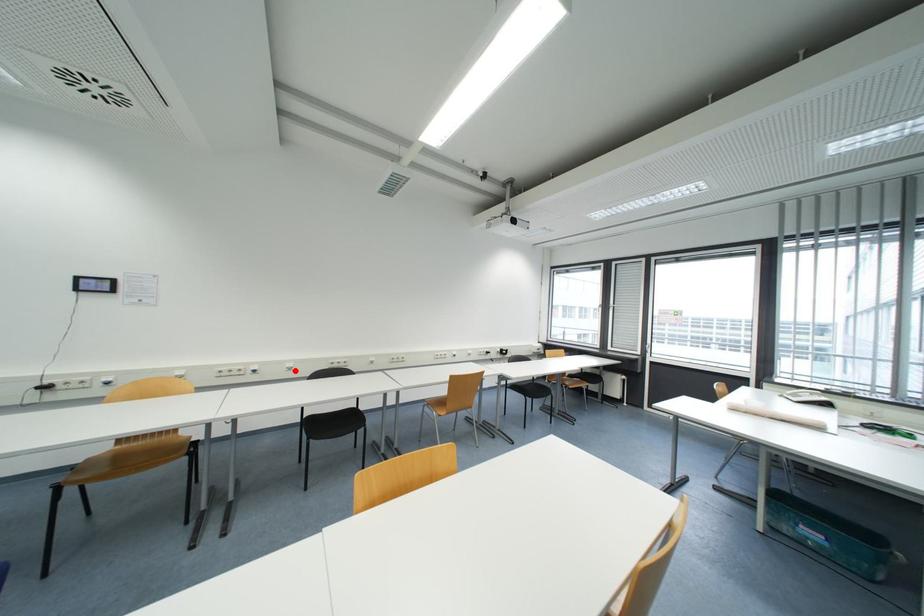
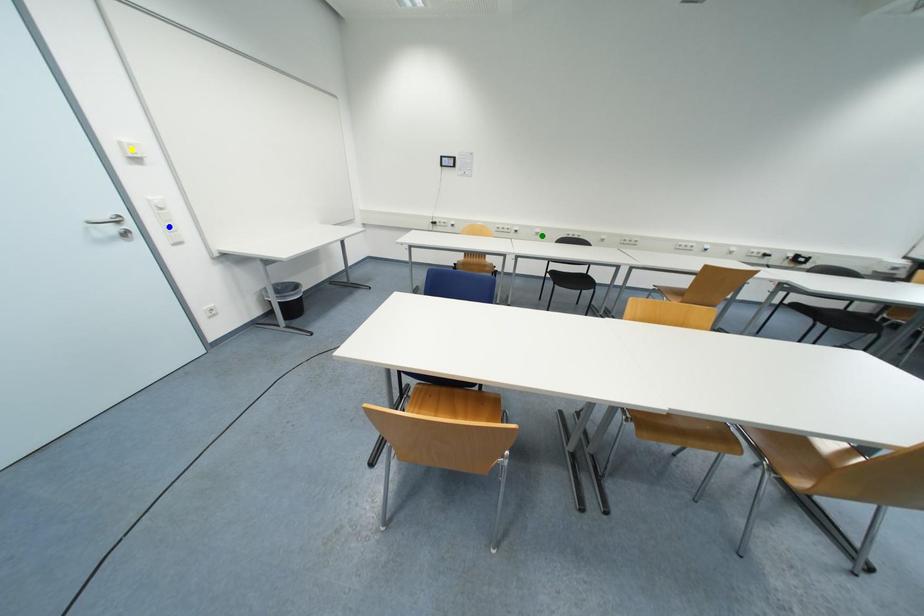
Question: I am providing you with two images of the same scene from different viewpoints. A red point is marked on the first image. You are given multiple points on the second image. Which point in image 2 represents the same 3d spot as the red point in image 1?

Choices:
 (A) green point
 (B) blue point
 (C) yellow point

Answer: (A)